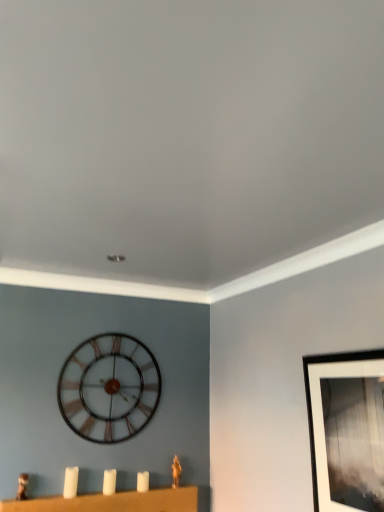
Question: Is metallic clock at center looking in the opposite direction of white matte candlesticks at lower center?

Choices:
 (A) no
 (B) yes

Answer: (A)

Question: From a real-world perspective, is metallic clock at center on white matte candlesticks at lower center?

Choices:
 (A) yes
 (B) no

Answer: (A)

Question: Does metallic clock at center appear on the left side of white matte candlesticks at lower center?

Choices:
 (A) yes
 (B) no

Answer: (A)

Question: Is metallic clock at center positioned in front of white matte candlesticks at lower center?

Choices:
 (A) no
 (B) yes

Answer: (A)

Question: Is metallic clock at center shorter than white matte candlesticks at lower center?

Choices:
 (A) yes
 (B) no

Answer: (B)

Question: Choose the correct answer: Is black matte picture frame at upper right inside metallic clock at center or outside it?

Choices:
 (A) inside
 (B) outside

Answer: (B)

Question: From a real-world perspective, is black matte picture frame at upper right above or below metallic clock at center?

Choices:
 (A) above
 (B) below

Answer: (B)

Question: Is point (360, 359) positioned closer to the camera than point (109, 357)?

Choices:
 (A) closer
 (B) farther

Answer: (A)

Question: Based on their positions, is black matte picture frame at upper right located to the left or right of metallic clock at center?

Choices:
 (A) right
 (B) left

Answer: (A)

Question: From the image's perspective, is white matte candlesticks at lower center above or below metallic clock at center?

Choices:
 (A) below
 (B) above

Answer: (A)

Question: Relative to metallic clock at center, is white matte candlesticks at lower center in front or behind?

Choices:
 (A) behind
 (B) front

Answer: (B)

Question: In the image, is white matte candlesticks at lower center on the left side or the right side of metallic clock at center?

Choices:
 (A) left
 (B) right

Answer: (B)

Question: Considering the positions of white matte candlesticks at lower center and metallic clock at center in the image, is white matte candlesticks at lower center wider or thinner than metallic clock at center?

Choices:
 (A) wide
 (B) thin

Answer: (A)

Question: Is white matte candlesticks at lower center situated inside white matte candle at lower left or outside?

Choices:
 (A) outside
 (B) inside

Answer: (A)

Question: Is white matte candlesticks at lower center taller or shorter than white matte candle at lower left?

Choices:
 (A) tall
 (B) short

Answer: (A)